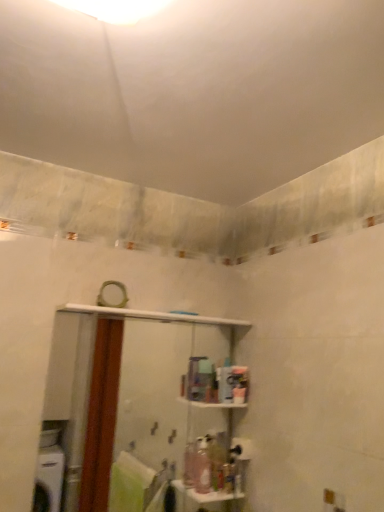
Question: Is translucent plastic soap dispenser at lower center, marked as the second toiletry in a left-to-right arrangement, to the left or to the right of pink plastic bottle at center, arranged as the 1th toiletry when viewed from the left, in the image?

Choices:
 (A) left
 (B) right

Answer: (B)

Question: Does point (225, 476) appear closer or farther from the camera than point (195, 458)?

Choices:
 (A) farther
 (B) closer

Answer: (B)

Question: Estimate the real-world distances between objects in this image. Which object is farther from the translucent plastic soap dispenser at lower center, the first toiletry in the right-to-left sequence?

Choices:
 (A) pink plastic bottle at center, the second toiletry from the right
 (B) matte white mirror at upper center
 (C) white glossy shelf at center

Answer: (B)

Question: Which object is the closest to the white glossy shelf at center?

Choices:
 (A) translucent plastic soap dispenser at lower center, the first toiletry in the right-to-left sequence
 (B) matte white mirror at upper center
 (C) pink plastic bottle at center, the second toiletry from the right

Answer: (C)